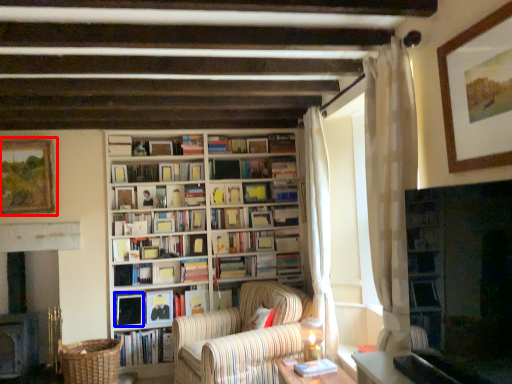
Question: Which of the following is the closest to the observer, picture frame (highlighted by a red box) or book (highlighted by a blue box)?

Choices:
 (A) picture frame
 (B) book

Answer: (A)